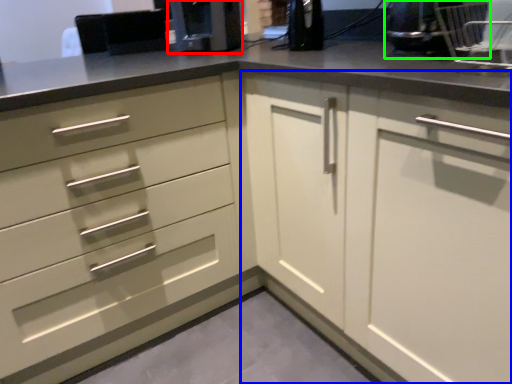
Question: Which object is the farthest from coffee machine (highlighted by a red box)? Choose among these: cabinetry (highlighted by a blue box) or appliance (highlighted by a green box).

Choices:
 (A) cabinetry
 (B) appliance

Answer: (B)